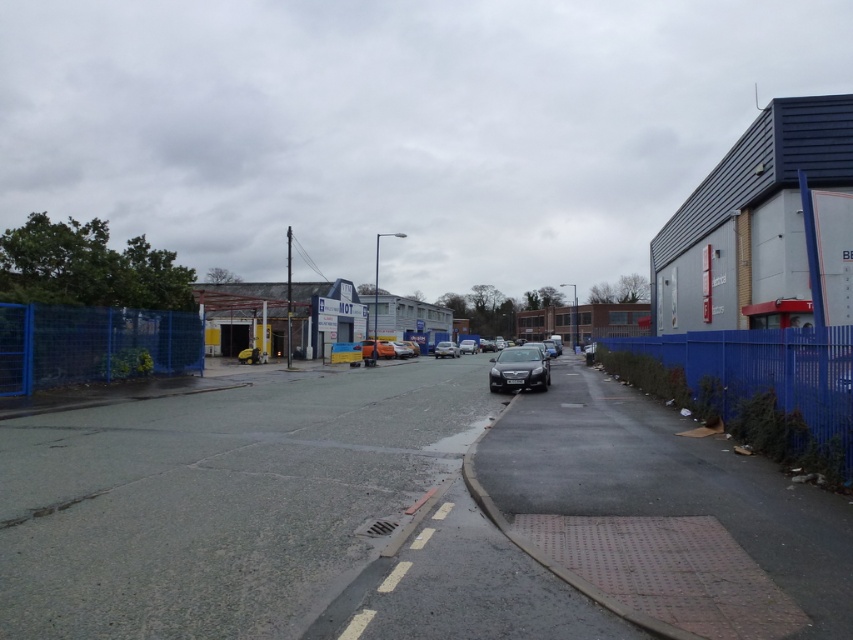
Measure the distance between point (126,326) and camera.

Point (126,326) and camera are 24.36 meters apart from each other.

Where is `blue mesh fence at lower left`? Image resolution: width=853 pixels, height=640 pixels. blue mesh fence at lower left is located at coordinates (91, 344).

Can you confirm if blue metal fence at right is positioned to the left of orange matte car at center?

No, blue metal fence at right is not to the left of orange matte car at center.

Can you confirm if blue metal fence at right is taller than orange matte car at center?

Indeed, blue metal fence at right has a greater height compared to orange matte car at center.

Locate an element on the screen. The height and width of the screenshot is (640, 853). blue metal fence at right is located at coordinates (767, 369).

Find the location of a particular element. This screenshot has height=640, width=853. blue metal fence at right is located at coordinates (767, 369).

Does orange matte car at center appear on the right side of shiny silver car at center?

Incorrect, orange matte car at center is not on the right side of shiny silver car at center.

Where is `orange matte car at center`? The width and height of the screenshot is (853, 640). orange matte car at center is located at coordinates (376, 348).

Does point (376, 349) come in front of point (456, 352)?

Yes, it is.

What are the coordinates of `orange matte car at center` in the screenshot? It's located at (376, 348).